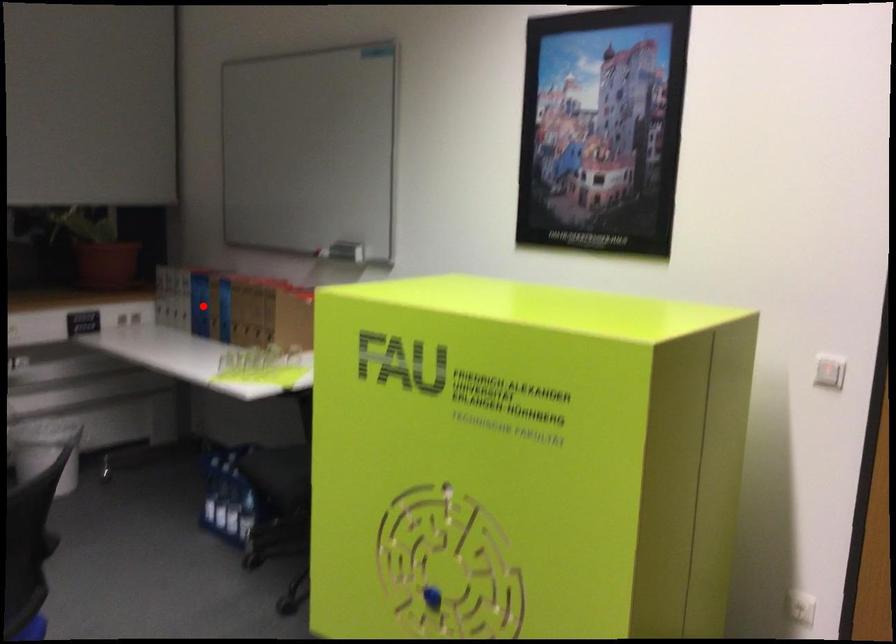
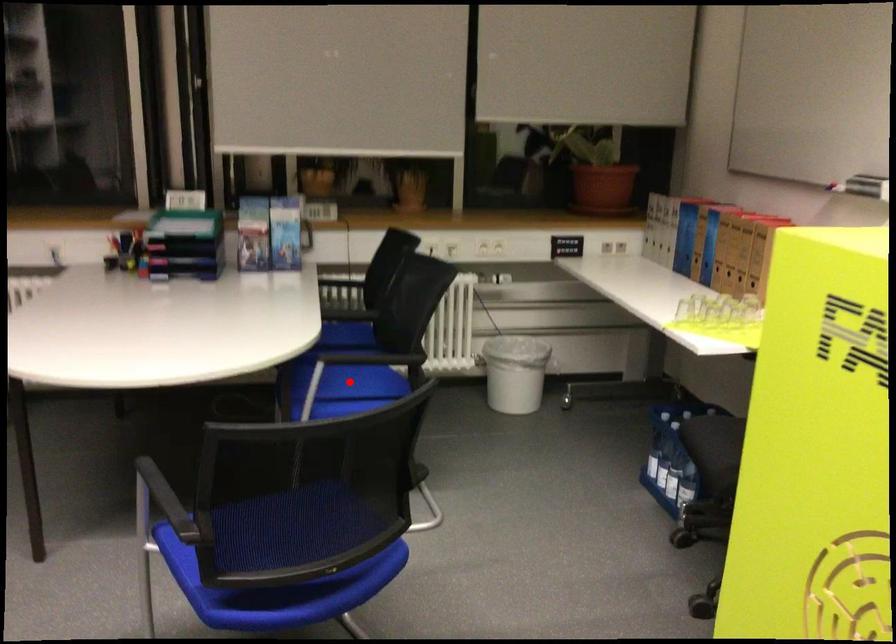
I am providing you with two images of the same scene from different viewpoints. A red point is marked on the first image and another point is marked on the second image. Are the points marked in image1 and image2 representing the same 3D position?

No